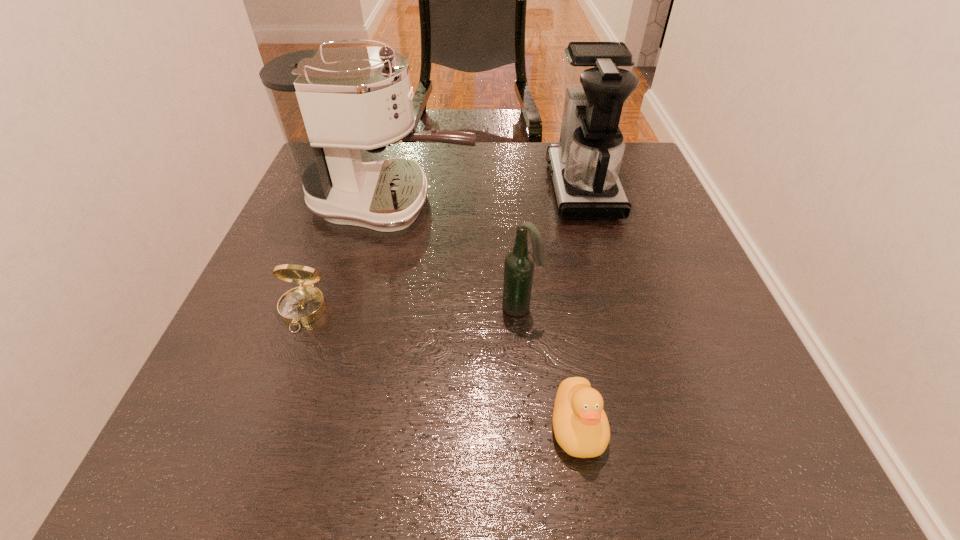
Find the location of a particular element. The image size is (960, 540). the left coffee maker is located at coordinates (330, 103).

Identify the location of the shorter coffee maker. Image resolution: width=960 pixels, height=540 pixels. (597, 78).

Find the location of a particular element. the second tallest object is located at coordinates (597, 78).

I want to click on beer bottle, so click(519, 263).

Identify the location of compass. (302, 305).

Find the location of a particular element. Image resolution: width=960 pixels, height=540 pixels. the nearest object is located at coordinates (581, 428).

Locate an element on the screen. The width and height of the screenshot is (960, 540). vacant point located on the front-facing side of the left coffee maker is located at coordinates (630, 203).

Image resolution: width=960 pixels, height=540 pixels. What are the coordinates of `vacant space situated at the front of the fourth shortest object where the controls are located` in the screenshot? It's located at (482, 188).

Identify the location of vacant region located 0.230m at the front of the fourth shortest object where the controls are located. This screenshot has width=960, height=540. (459, 188).

This screenshot has width=960, height=540. I want to click on free space located at the front of the fourth shortest object where the controls are located, so click(436, 188).